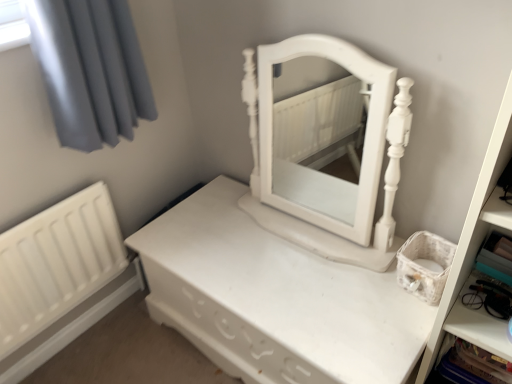
Question: Is white matte bookshelf at right completely or partially inside white matte radiator at lower left?

Choices:
 (A) yes
 (B) no

Answer: (B)

Question: Is the depth of white matte radiator at lower left less than that of white matte bookshelf at right?

Choices:
 (A) yes
 (B) no

Answer: (B)

Question: From a real-world perspective, is white matte radiator at lower left positioned over white matte bookshelf at right based on gravity?

Choices:
 (A) no
 (B) yes

Answer: (A)

Question: Does white matte radiator at lower left have a lesser height compared to white matte bookshelf at right?

Choices:
 (A) yes
 (B) no

Answer: (A)

Question: Does white matte radiator at lower left have a lesser width compared to white matte bookshelf at right?

Choices:
 (A) no
 (B) yes

Answer: (B)

Question: Does point pyautogui.click(x=457, y=339) appear closer or farther from the camera than point pyautogui.click(x=100, y=188)?

Choices:
 (A) farther
 (B) closer

Answer: (B)

Question: Considering the positions of white plastic cabinet at lower right and white matte radiator at lower left in the image, is white plastic cabinet at lower right taller or shorter than white matte radiator at lower left?

Choices:
 (A) tall
 (B) short

Answer: (B)

Question: In the image, is white plastic cabinet at lower right on the left side or the right side of white matte radiator at lower left?

Choices:
 (A) left
 (B) right

Answer: (B)

Question: Is white plastic cabinet at lower right in front of or behind white matte radiator at lower left in the image?

Choices:
 (A) behind
 (B) front

Answer: (B)

Question: From the image's perspective, is white matte/wooden nightstand at center above or below white matte radiator at lower left?

Choices:
 (A) above
 (B) below

Answer: (B)

Question: Considering their positions, is white matte/wooden nightstand at center located in front of or behind white matte radiator at lower left?

Choices:
 (A) front
 (B) behind

Answer: (A)

Question: Considering the positions of white matte/wooden nightstand at center and white matte radiator at lower left in the image, is white matte/wooden nightstand at center taller or shorter than white matte radiator at lower left?

Choices:
 (A) short
 (B) tall

Answer: (A)

Question: Based on their sizes in the image, would you say white matte/wooden nightstand at center is bigger or smaller than white matte radiator at lower left?

Choices:
 (A) small
 (B) big

Answer: (B)

Question: In terms of width, does white matte radiator at lower left look wider or thinner when compared to white plastic cabinet at lower right?

Choices:
 (A) wide
 (B) thin

Answer: (B)

Question: From a real-world perspective, is white matte radiator at lower left above or below white plastic cabinet at lower right?

Choices:
 (A) above
 (B) below

Answer: (A)